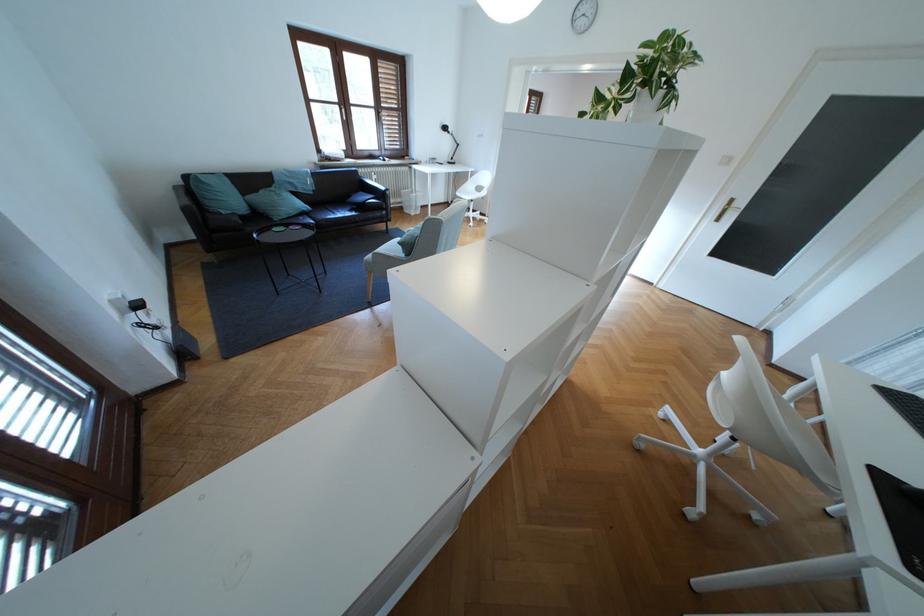
Find the location of `brass door handle`. brass door handle is located at coordinates (730, 206).